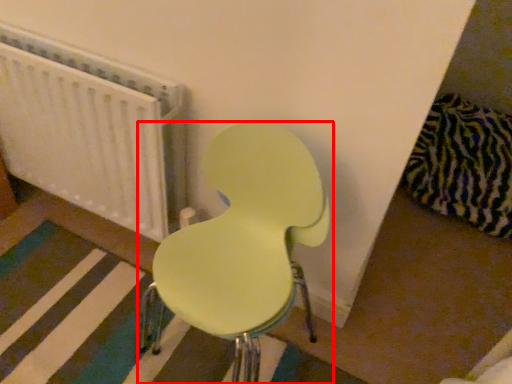
Question: In this image, where is chair (annotated by the red box) located relative to radiator?

Choices:
 (A) left
 (B) right

Answer: (B)